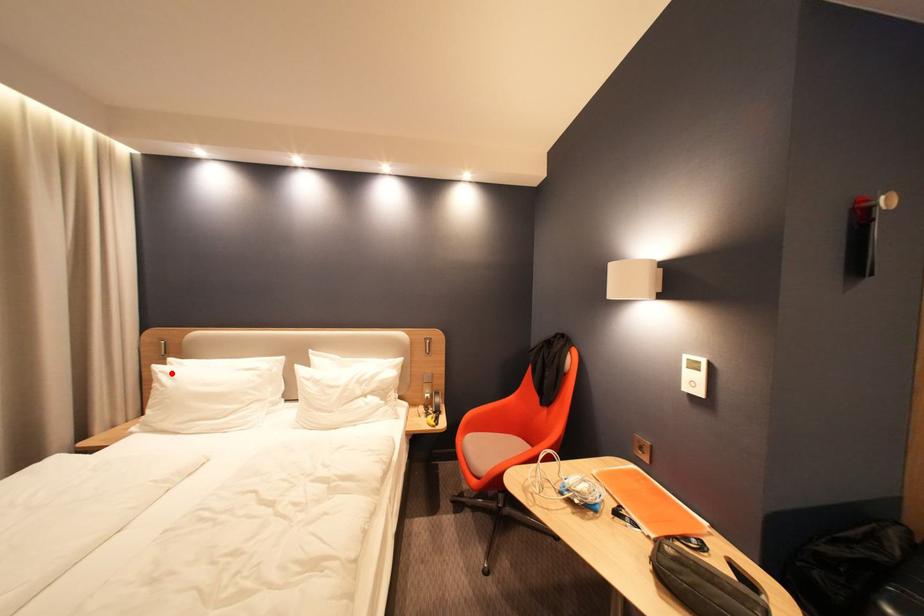
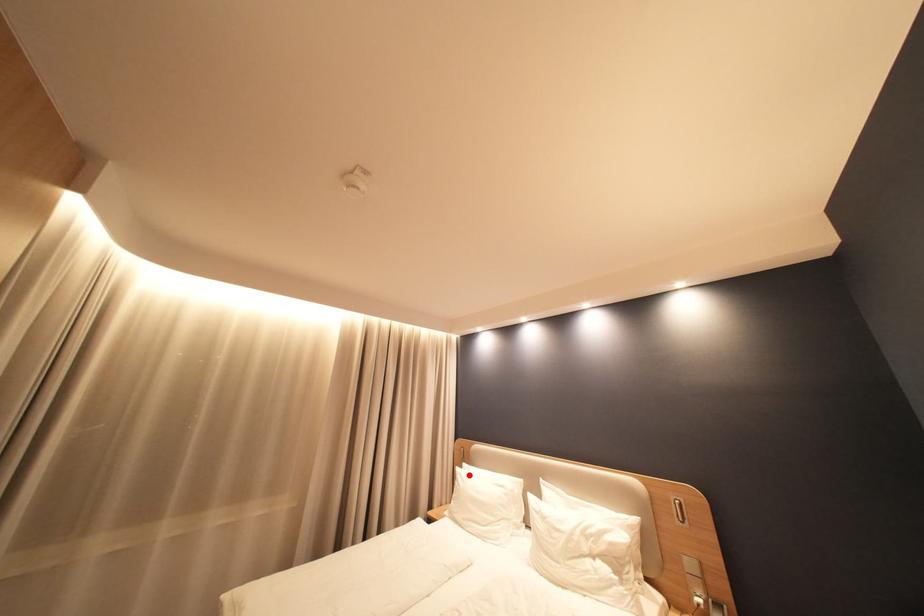
I am providing you with two images of the same scene from different viewpoints. A red point is marked on the first image and another point is marked on the second image. Is the marked point in image1 the same physical position as the marked point in image2?

Yes